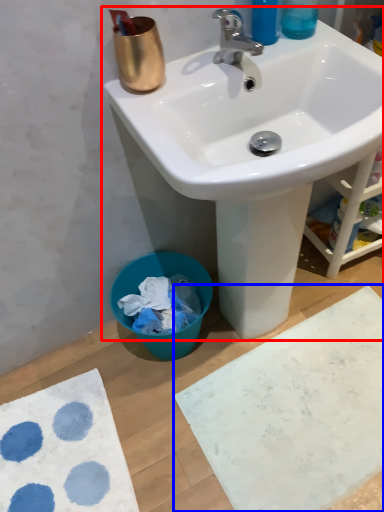
Question: Which point is closer to the camera, sink (highlighted by a red box) or bath mat (highlighted by a blue box)?

Choices:
 (A) sink
 (B) bath mat

Answer: (A)